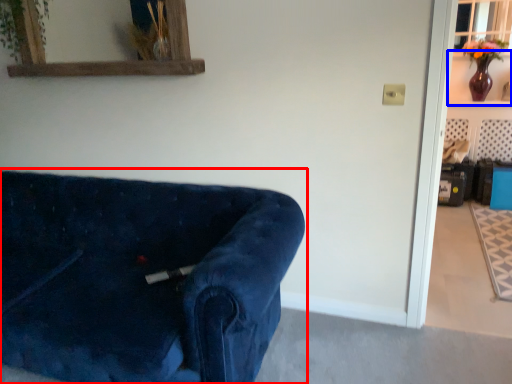
Question: Which of the following is the closest to the observer, studio couch (highlighted by a red box) or shelf (highlighted by a blue box)?

Choices:
 (A) studio couch
 (B) shelf

Answer: (A)